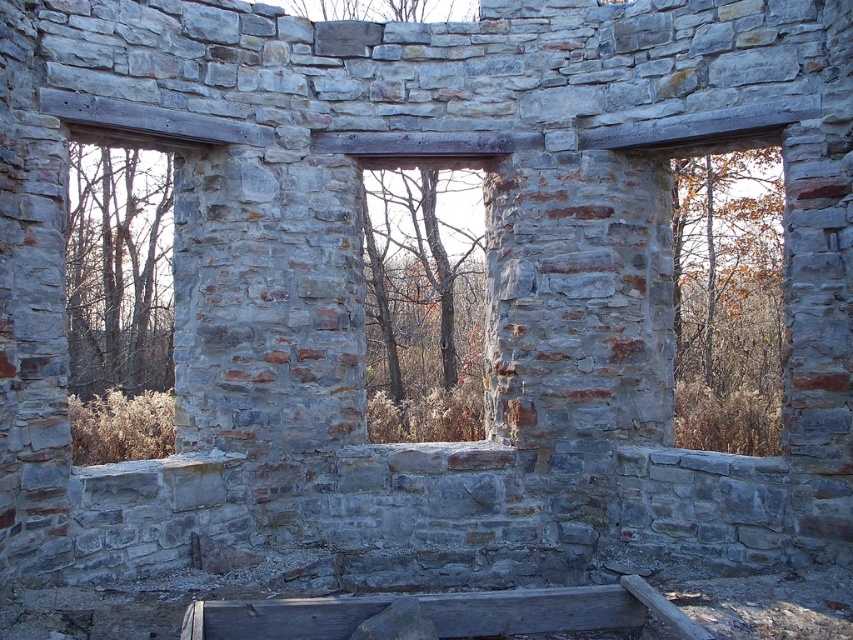
You are standing in the old stone structure and want to reach the point marked at coordinates (479, 282). Given that your maximum comfortable walking distance is 60 feet, will you be able to reach it without straining?

The point at coordinates (479, 282) is 61.94 feet away from the camera, which exceeds your maximum comfortable walking distance of 60 feet. Therefore, reaching it would require some strain.